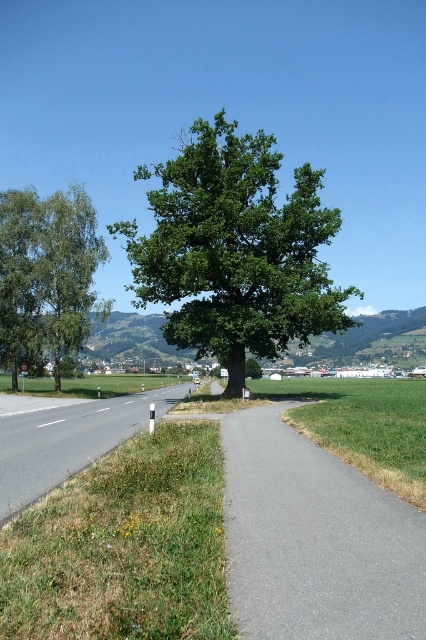
Does point (264, 316) come closer to viewer compared to point (52, 230)?

That is True.

Who is lower down, green leafy tree at center or green matte tree at left?

green matte tree at left is below.

You are a GUI agent. You are given a task and a screenshot of the screen. Output one action in this format:
    pyautogui.click(x=<x>, y=<y>)
    Task: Click on the green leafy tree at center
    This screenshot has height=640, width=426.
    Given the screenshot: What is the action you would take?
    pyautogui.click(x=235, y=250)

I want to click on green leafy tree at center, so click(x=235, y=250).

Does green leafy tree at center appear over green grass at lower left?

Yes.

Can you confirm if green leafy tree at center is smaller than green grass at lower left?

No, green leafy tree at center is not smaller than green grass at lower left.

Measure the distance between green leafy tree at center and camera.

green leafy tree at center and camera are 90.93 feet apart.

Find the location of a particular element. This screenshot has width=426, height=640. green leafy tree at center is located at coordinates (235, 250).

Who is higher up, gray asphalt path at center or green matte tree at left?

Positioned higher is green matte tree at left.

Does gray asphalt path at center have a lesser width compared to green matte tree at left?

Correct, gray asphalt path at center's width is less than green matte tree at left's.

Does point (344, 584) come in front of point (51, 296)?

Yes, point (344, 584) is closer to viewer.

Where is `gray asphalt path at center`? gray asphalt path at center is located at coordinates (314, 540).